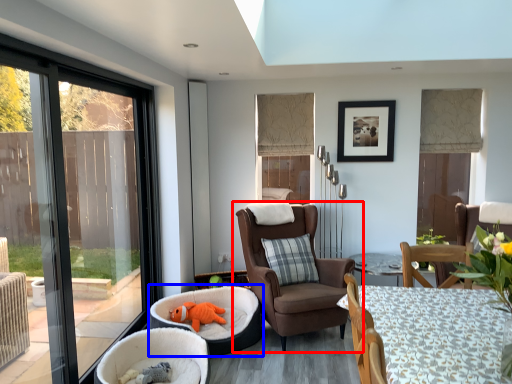
Question: Which point is further to the camera, chair (highlighted by a red box) or infant bed (highlighted by a blue box)?

Choices:
 (A) chair
 (B) infant bed

Answer: (A)